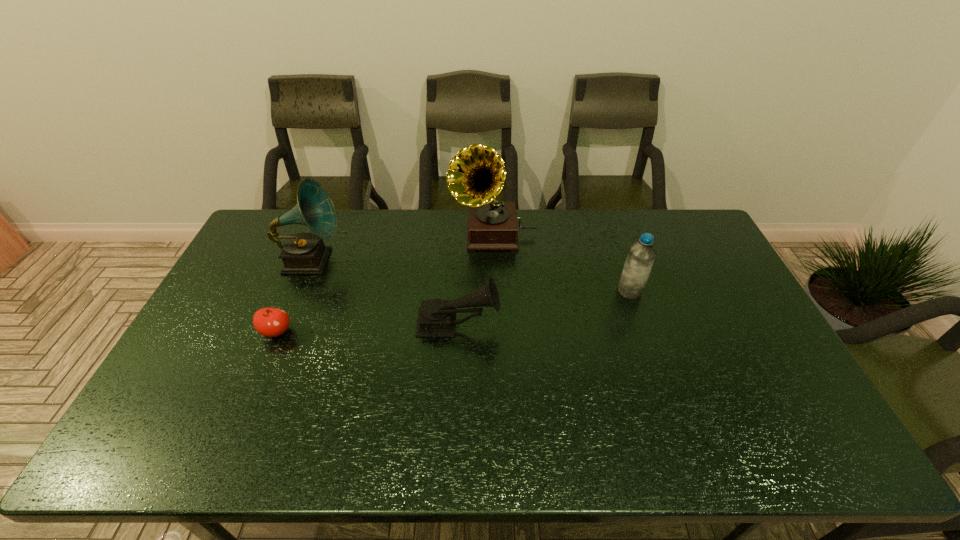
At what (x,y) coordinates should I click in order to perform the action: click on object located at the left edge. Please return your answer as a coordinate pair (x, y). The height and width of the screenshot is (540, 960). Looking at the image, I should click on (304, 253).

You are a GUI agent. You are given a task and a screenshot of the screen. Output one action in this format:
    pyautogui.click(x=<x>, y=<y>)
    Task: Click on the object that is at the far left corner
    
    Given the screenshot: What is the action you would take?
    pyautogui.click(x=304, y=253)

The image size is (960, 540). I want to click on vacant space at the far edge of the desktop, so click(x=550, y=240).

Find the location of a particular element. The width and height of the screenshot is (960, 540). vacant area at the near edge is located at coordinates (318, 441).

I want to click on blank area at the left edge, so click(x=222, y=330).

This screenshot has width=960, height=540. In the image, there is a desktop. Find the location of `free space at the right edge`. free space at the right edge is located at coordinates point(783,401).

I want to click on vacant space at the far right corner of the desktop, so click(x=680, y=240).

You are a GUI agent. You are given a task and a screenshot of the screen. Output one action in this format:
    pyautogui.click(x=<x>, y=<y>)
    Task: Click on the vacant space that is in between the leftmost phonograph_record and the third tallest object
    The width and height of the screenshot is (960, 540).
    Given the screenshot: What is the action you would take?
    pyautogui.click(x=470, y=276)

Where is `vacant area that lies between the nearest phonograph_record and the apple`? vacant area that lies between the nearest phonograph_record and the apple is located at coordinates (368, 328).

Where is `unoccupied area between the apple and the second shortest object`? unoccupied area between the apple and the second shortest object is located at coordinates (368, 328).